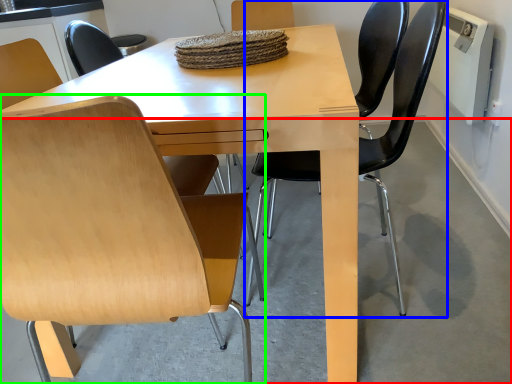
Question: Which object is positioned farthest from concrete (highlighted by a red box)? Select from chair (highlighted by a blue box) and chair (highlighted by a green box).

Choices:
 (A) chair
 (B) chair

Answer: (B)